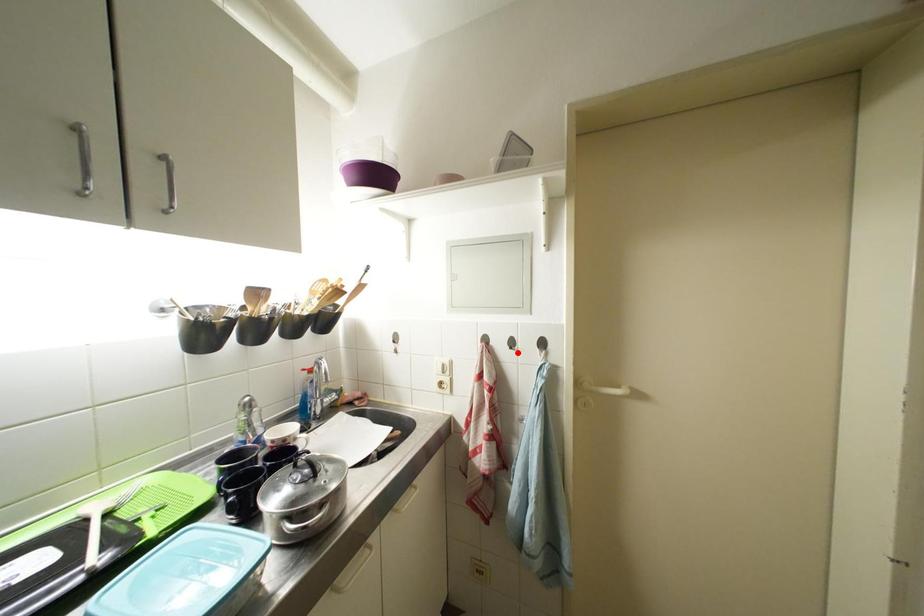
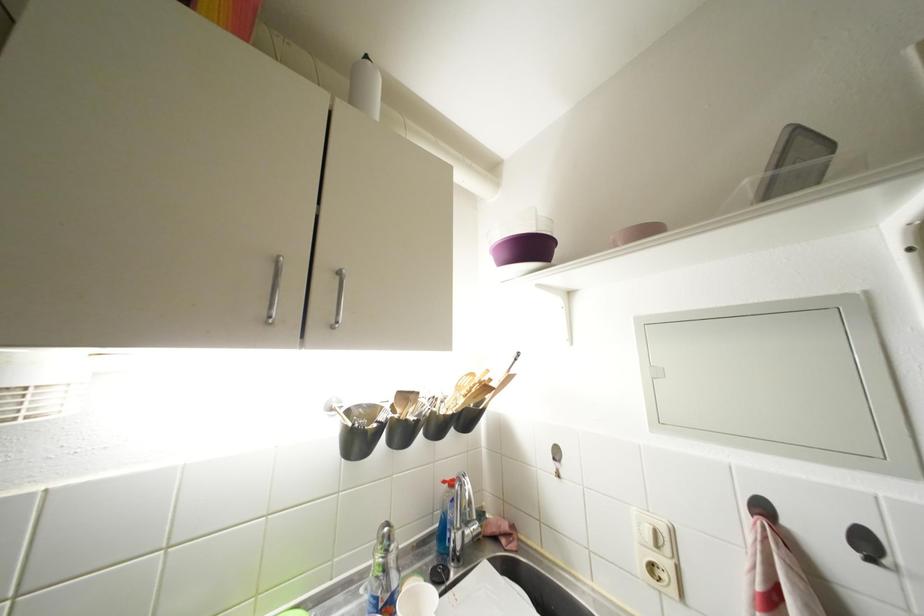
Question: I am providing you with two images of the same scene from different viewpoints. A red point is shown in image1. For the corresponding object point in image2, is it positioned nearer or farther from the camera?

Choices:
 (A) Nearer
 (B) Farther

Answer: (A)